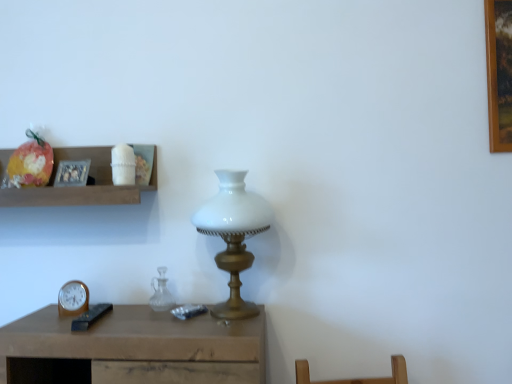
Question: Considering the positions of point (142, 190) and point (51, 162), is point (142, 190) closer or farther from the camera than point (51, 162)?

Choices:
 (A) closer
 (B) farther

Answer: (A)

Question: Choose the correct answer: Is wooden shelf at upper left inside shiny plastic bag at upper left or outside it?

Choices:
 (A) outside
 (B) inside

Answer: (A)

Question: Which of these objects is positioned closest to the metallic silver picture frame at upper left?

Choices:
 (A) wooden shelf at upper left
 (B) wooden clock at lower left
 (C) white glass lamp at center
 (D) transparent glass vase at center
 (E) shiny plastic bag at upper left

Answer: (A)

Question: Based on their relative distances, which object is farther from the wooden shelf at upper left?

Choices:
 (A) wooden clock at lower left
 (B) white glass lamp at center
 (C) metallic silver picture frame at upper left
 (D) shiny plastic bag at upper left
 (E) transparent glass vase at center

Answer: (E)